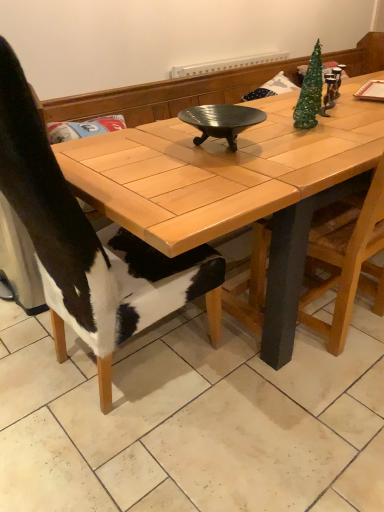
The width and height of the screenshot is (384, 512). Find the location of `vacant space in front of cowhide at left, which ranks as the first chair in left-to-right order`. vacant space in front of cowhide at left, which ranks as the first chair in left-to-right order is located at coordinates point(129,455).